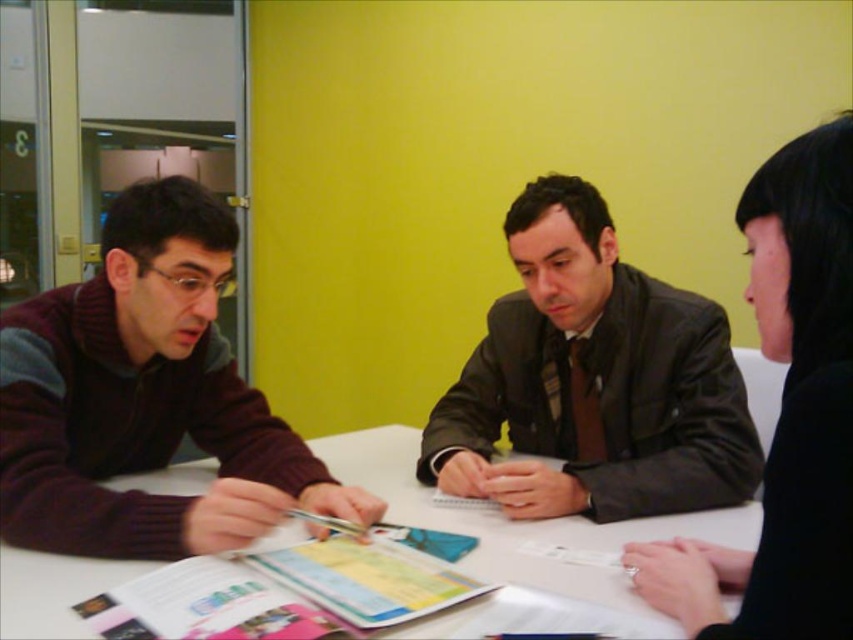
Question: Which of the following is the farthest from the observer?

Choices:
 (A) dark brown leather jacket at center
 (B) black matte hair at upper right
 (C) white paper at center

Answer: (A)

Question: Which is nearer to the white paper at center?

Choices:
 (A) black matte hair at upper right
 (B) dark brown leather jacket at center

Answer: (B)

Question: Which point is closer to the camera taking this photo?

Choices:
 (A) (846, 144)
 (B) (148, 513)
 (C) (399, 433)

Answer: (A)

Question: Does maroon sweater at left appear on the left side of white paper at center?

Choices:
 (A) yes
 (B) no

Answer: (A)

Question: Observing the image, what is the correct spatial positioning of dark brown leather jacket at center in reference to white paper at center?

Choices:
 (A) left
 (B) right

Answer: (B)

Question: Does maroon sweater at left lie in front of black matte hair at upper right?

Choices:
 (A) no
 (B) yes

Answer: (A)